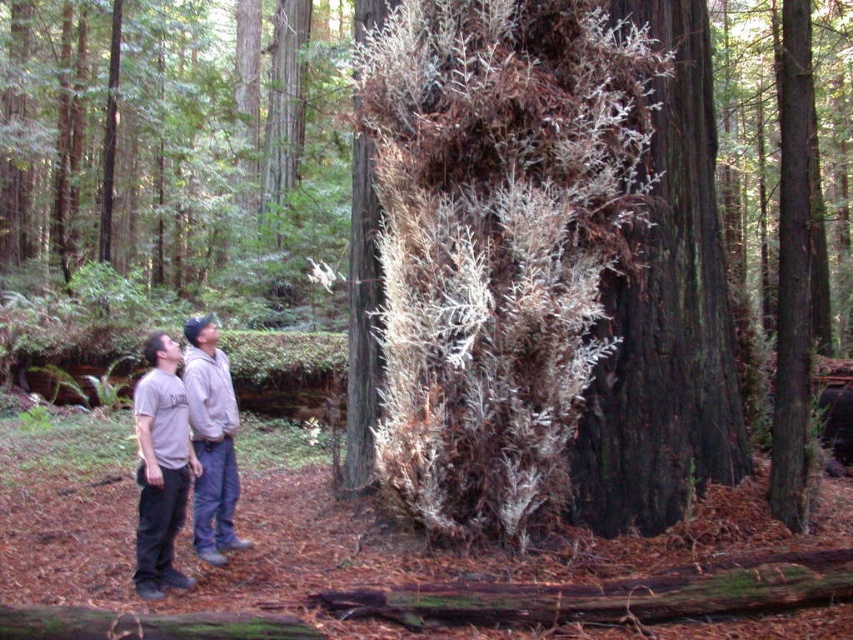
Question: Can you confirm if dark brown rough bark at center is positioned above gray fleece jacket at lower left?

Choices:
 (A) no
 (B) yes

Answer: (B)

Question: Among these objects, which one is farthest from the camera?

Choices:
 (A) gray cotton t-shirt at lower left
 (B) dark brown rough bark at center
 (C) gray fleece jacket at lower left

Answer: (B)

Question: Is gray cotton t-shirt at lower left smaller than gray fleece jacket at lower left?

Choices:
 (A) no
 (B) yes

Answer: (A)

Question: Which of the following is the farthest from the observer?

Choices:
 (A) (691, 28)
 (B) (165, 356)

Answer: (A)

Question: Which point is farther from the camera taking this photo?

Choices:
 (A) [x=196, y=528]
 (B) [x=695, y=113]

Answer: (B)

Question: Can you confirm if dark brown rough bark at center is positioned to the left of gray cotton t-shirt at lower left?

Choices:
 (A) yes
 (B) no

Answer: (B)